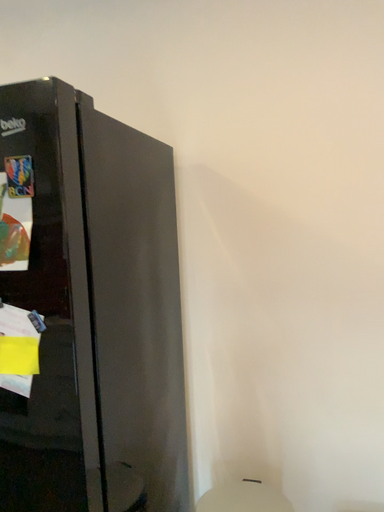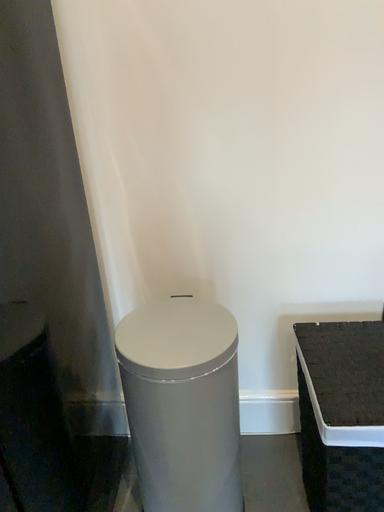
Question: How did the camera likely rotate when shooting the video?

Choices:
 (A) rotated left
 (B) rotated right

Answer: (B)